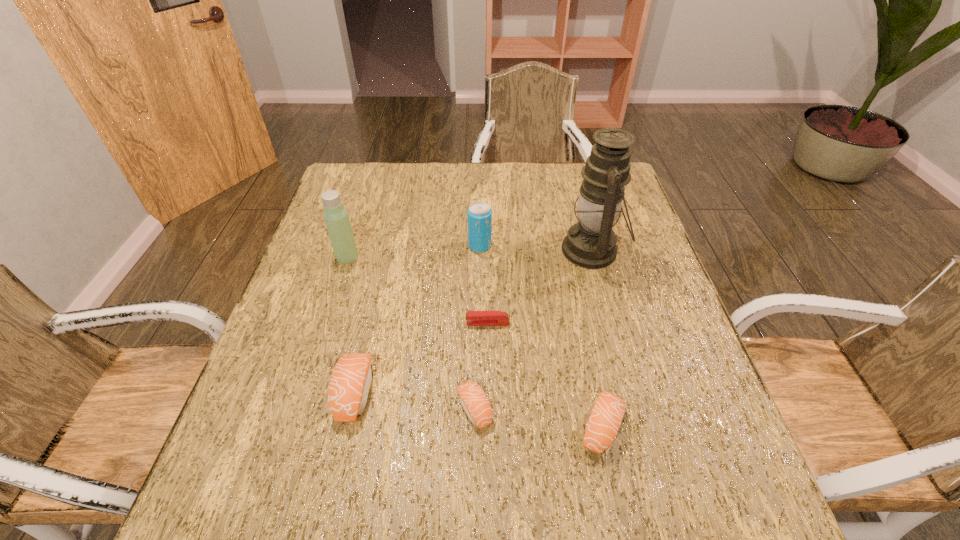
At what (x,y) coordinates should I click in order to perform the action: click on object present at the right edge. Please return your answer as a coordinate pair (x, y). Looking at the image, I should click on (591, 243).

The height and width of the screenshot is (540, 960). Identify the location of vacant point at the far edge. (554, 178).

Locate an element on the screen. free space at the near edge of the desktop is located at coordinates (558, 423).

This screenshot has width=960, height=540. In the image, there is a desktop. What are the coordinates of `free space at the left edge` in the screenshot? It's located at coord(299,414).

At what (x,y) coordinates should I click in order to perform the action: click on vacant region at the right edge of the desktop. Please return your answer as a coordinate pair (x, y). Looking at the image, I should click on (616, 336).

Locate an element on the screen. The image size is (960, 540). free location at the far left corner is located at coordinates (339, 181).

Locate an element on the screen. This screenshot has width=960, height=540. free space at the near left corner is located at coordinates (234, 433).

I want to click on vacant space that's between the rightmost sushi and the shortest sushi, so click(538, 417).

Where is `vacant area that lies between the rightmost sushi and the thermos bottle`? This screenshot has width=960, height=540. vacant area that lies between the rightmost sushi and the thermos bottle is located at coordinates (474, 341).

I want to click on vacant space that's between the second object from left to right and the fourth nearest object, so click(x=420, y=358).